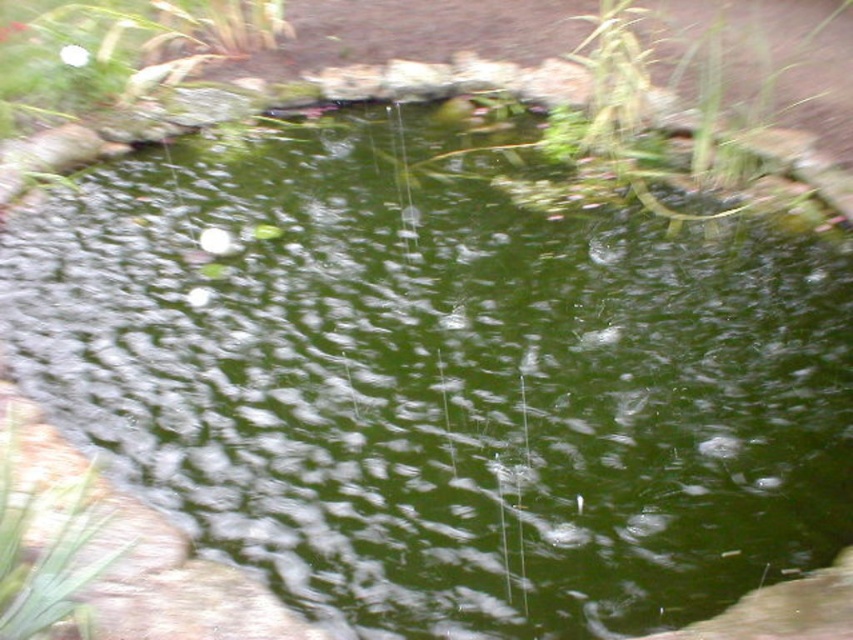
Based on the photo, you are a gardener who wants to place a new small statue that is 10 cm tall. You have two options for placement near the white matte rock at upper left and the green leafy plant at upper center. Which location would allow the statue to be more visible without being blocked?

The white matte rock at upper left has a greater height compared to the green leafy plant at upper center. Placing the statue near the white matte rock at upper left would allow it to be more visible since it is taller and can provide a higher base for the statue.